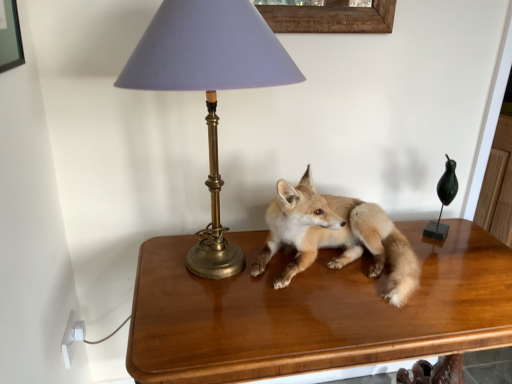
This screenshot has height=384, width=512. I want to click on vacant region to the right of light brown fur fox at center, so click(467, 271).